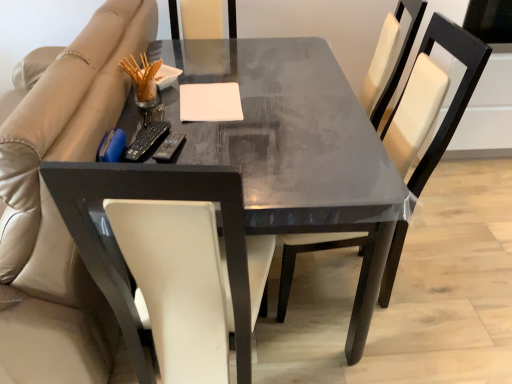
Question: Is white matte notepad at center beside matte black table at center?

Choices:
 (A) no
 (B) yes

Answer: (A)

Question: Is the position of white matte notepad at center less distant than that of matte black table at center?

Choices:
 (A) yes
 (B) no

Answer: (B)

Question: Does white matte notepad at center contain matte black table at center?

Choices:
 (A) yes
 (B) no

Answer: (B)

Question: Is white matte notepad at center to the right of matte black table at center from the viewer's perspective?

Choices:
 (A) no
 (B) yes

Answer: (A)

Question: From a real-world perspective, does white matte notepad at center sit lower than matte black table at center?

Choices:
 (A) no
 (B) yes

Answer: (A)

Question: Is white matte notepad at center facing away from matte black table at center?

Choices:
 (A) yes
 (B) no

Answer: (A)

Question: From the image's perspective, does matte black table at center appear lower than white matte notepad at center?

Choices:
 (A) no
 (B) yes

Answer: (B)

Question: Would you say matte black table at center is a long distance from white matte notepad at center?

Choices:
 (A) yes
 (B) no

Answer: (B)

Question: Is the position of matte black table at center more distant than that of white matte notepad at center?

Choices:
 (A) yes
 (B) no

Answer: (B)

Question: Can you confirm if matte black table at center is positioned to the right of white matte notepad at center?

Choices:
 (A) yes
 (B) no

Answer: (A)

Question: Does matte black table at center have a lesser width compared to white matte notepad at center?

Choices:
 (A) no
 (B) yes

Answer: (A)

Question: Does matte black table at center lie in front of white matte notepad at center?

Choices:
 (A) yes
 (B) no

Answer: (A)

Question: Can you confirm if beige leather couch at left is positioned to the right of white matte notepad at center?

Choices:
 (A) yes
 (B) no

Answer: (B)